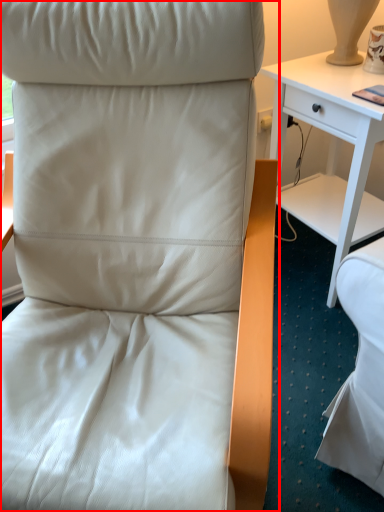
Question: From the image's perspective, considering the relative positions of chair (annotated by the red box) and desk in the image provided, where is chair (annotated by the red box) located with respect to the staircase?

Choices:
 (A) above
 (B) below

Answer: (B)